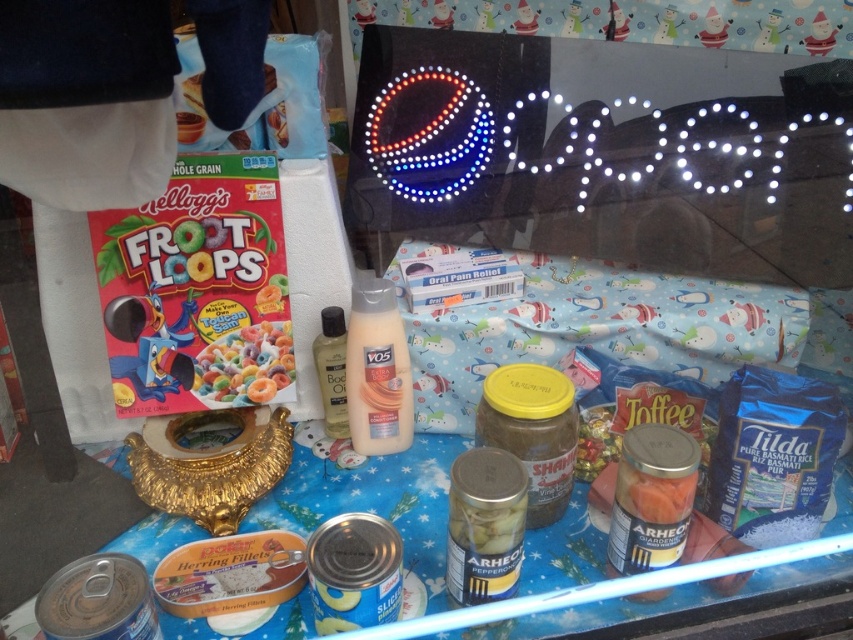
Question: Observing the image, what is the correct spatial positioning of translucent plastic bottle at center in reference to bright yellow cereal at center?

Choices:
 (A) above
 (B) below

Answer: (B)

Question: Is translucent plastic bottle at center below bright yellow cereal at center?

Choices:
 (A) yes
 (B) no

Answer: (A)

Question: Which object is closer to the camera taking this photo?

Choices:
 (A) translucent plastic bottle at center
 (B) bright yellow cereal at center

Answer: (A)

Question: Can you confirm if translucent plastic bottle at center is wider than bright yellow cereal at center?

Choices:
 (A) no
 (B) yes

Answer: (A)